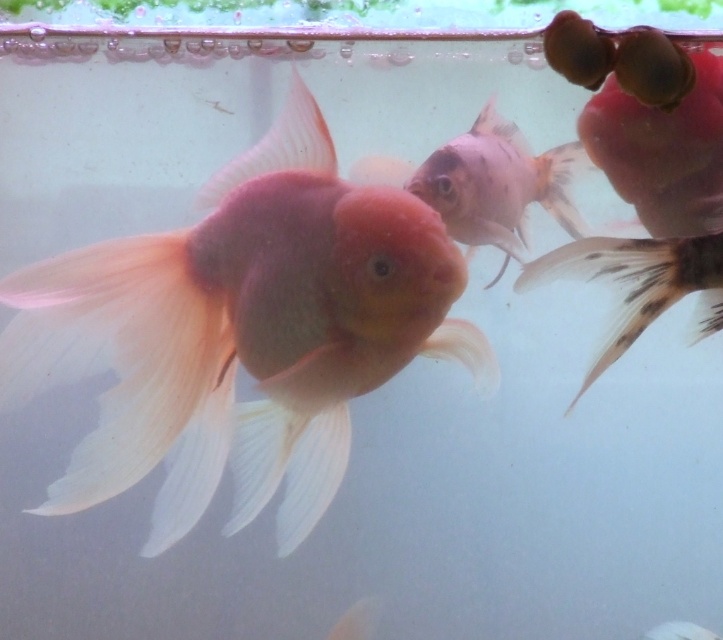
Can you confirm if matte pink goldfish at center is taller than black spotted tail fin at right?

Correct, matte pink goldfish at center is much taller as black spotted tail fin at right.

Is matte pink goldfish at center to the left of black spotted tail fin at right from the viewer's perspective?

Yes, matte pink goldfish at center is to the left of black spotted tail fin at right.

Between point (346, 410) and point (654, 250), which one is positioned in front?

Point (654, 250) is in front.

Locate an element on the screen. The width and height of the screenshot is (723, 640). matte pink goldfish at center is located at coordinates (241, 332).

Which is above, translucent pink fish at center or black spotted tail fin at right?

translucent pink fish at center is higher up.

Can you confirm if translucent pink fish at center is wider than black spotted tail fin at right?

Incorrect, translucent pink fish at center's width does not surpass black spotted tail fin at right's.

Which is behind, point (502, 224) or point (521, 280)?

Positioned behind is point (502, 224).

Locate an element on the screen. This screenshot has width=723, height=640. translucent pink fish at center is located at coordinates 495,186.

The image size is (723, 640). I want to click on matte pink goldfish at center, so click(x=241, y=332).

Does matte pink goldfish at center lie behind translucent pink fish at center?

No, it is not.

Which is behind, point (489, 371) or point (539, 200)?

The point (539, 200) is behind.

You are a GUI agent. You are given a task and a screenshot of the screen. Output one action in this format:
    pyautogui.click(x=<x>, y=<y>)
    Task: Click on the matte pink goldfish at center
    This screenshot has width=723, height=640.
    Given the screenshot: What is the action you would take?
    pyautogui.click(x=241, y=332)